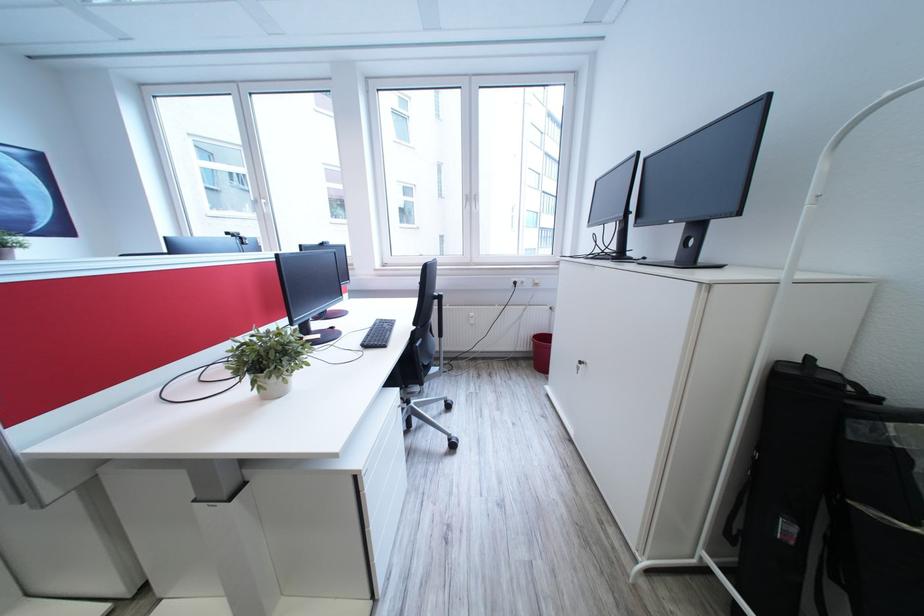
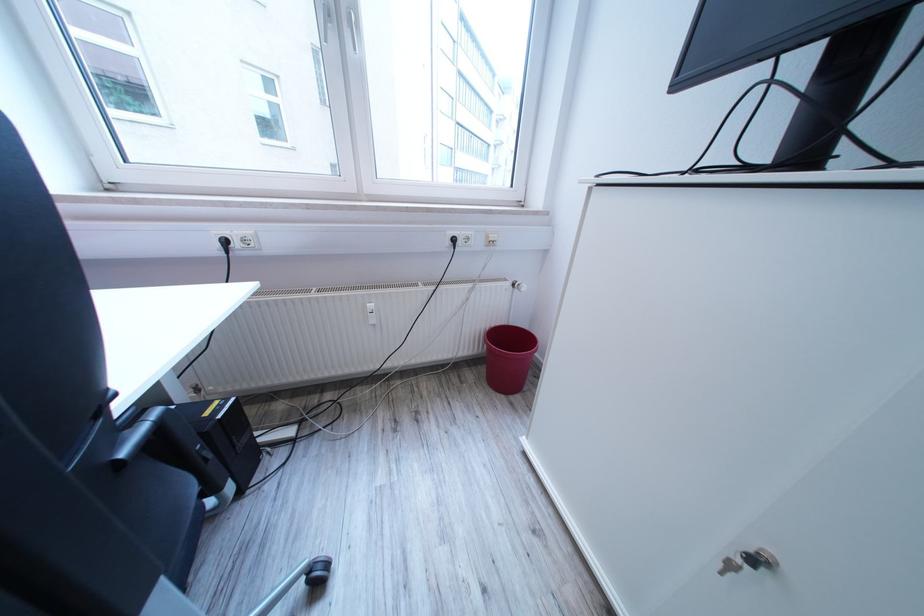
The point at (482, 326) is marked in the first image. Where is the corresponding point in the second image?

(385, 326)